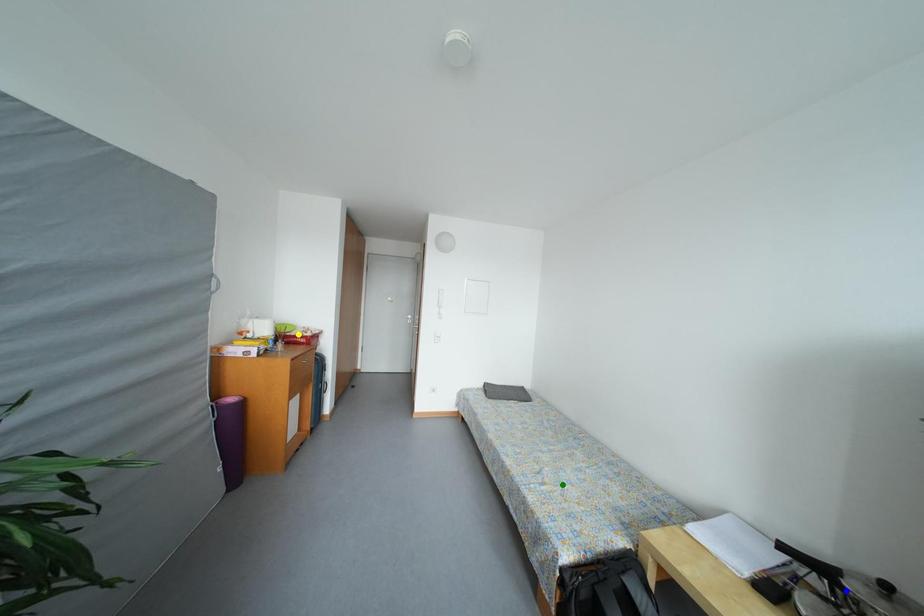
Consider the image. Order these from nearest to farthest:
green point, yellow point, blue point

blue point, green point, yellow point